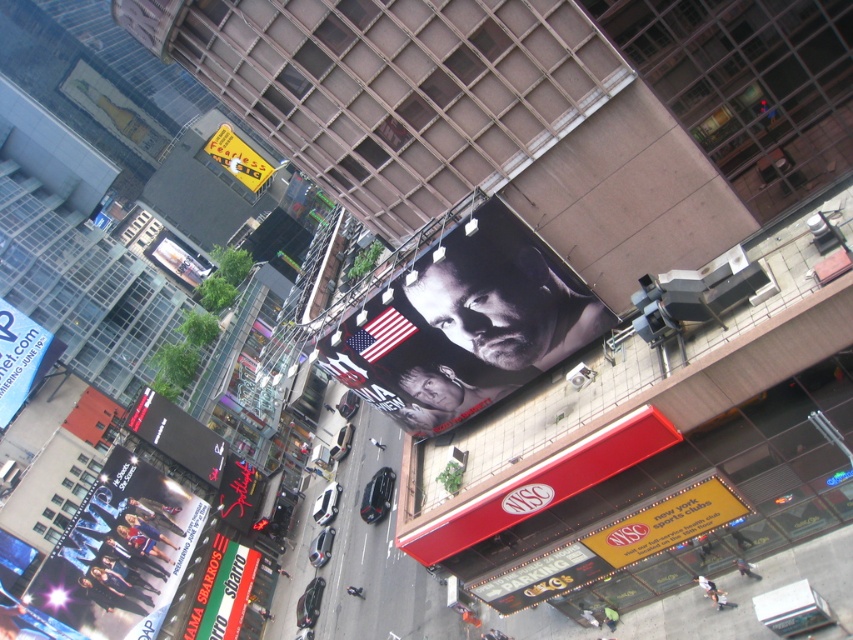
Who is taller, yellow fabric sign at center or yellow plastic sign at upper left?

yellow plastic sign at upper left is taller.

Is yellow fabric sign at center to the right of yellow plastic sign at upper left from the viewer's perspective?

Yes, yellow fabric sign at center is to the right of yellow plastic sign at upper left.

Is point (665, 499) positioned after point (231, 172)?

No, (665, 499) is in front of (231, 172).

Where is `yellow fabric sign at center`? Image resolution: width=853 pixels, height=640 pixels. yellow fabric sign at center is located at coordinates (666, 524).

Between point (558, 278) and point (196, 460), which one is positioned in front?

Point (558, 278) is more forward.

Is point (485, 346) positioned in front of point (148, 404)?

Yes, it is.

Is point (572, 291) positioned after point (199, 422)?

No.

Identify the location of black glossy poster at center. This screenshot has width=853, height=640. (463, 324).

Is black glossy poster at center shorter than blue plastic billboard at upper left?

No, black glossy poster at center is not shorter than blue plastic billboard at upper left.

Is point (476, 324) more distant than point (32, 321)?

No, it is in front of (32, 321).

Is point (569, 269) closer to camera compared to point (10, 392)?

That is True.

Locate an element on the screen. Image resolution: width=853 pixels, height=640 pixels. black glossy poster at center is located at coordinates (463, 324).